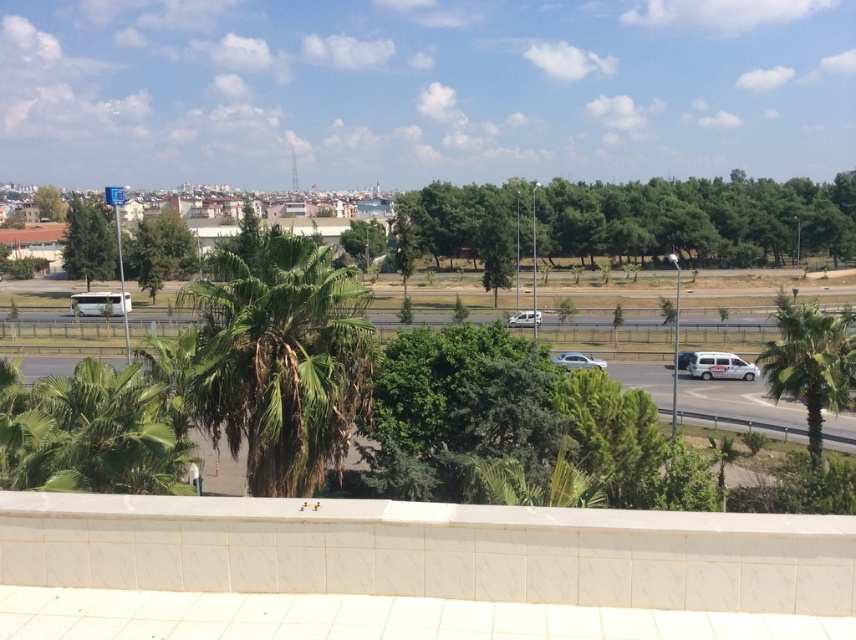
You are standing on the tiled ledge and want to walk to the distant urban skyline. There are two points marked on the path you need to pass through. Which point should you step on first, point (107,294) or point (520,312)?

You should step on point (520,312) first because point (107,294) is behind it, meaning point (520,312) comes before point (107,294) along your path to the skyline.